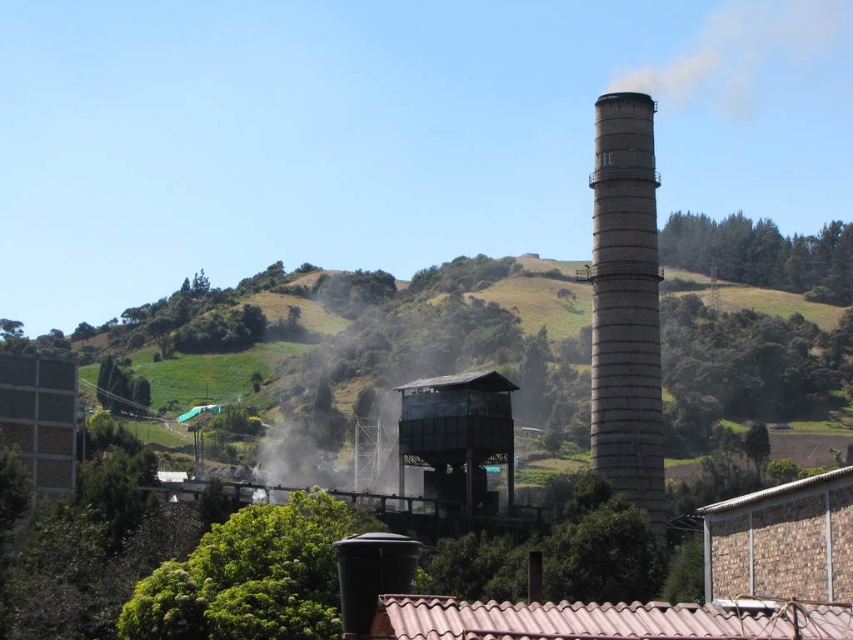
Question: In this image, where is green grassy hillside at center located relative to gray concrete chimney at center-right?

Choices:
 (A) left
 (B) right

Answer: (A)

Question: Does green grassy hillside at center appear on the right side of matte black tower at center?

Choices:
 (A) yes
 (B) no

Answer: (B)

Question: Based on their relative distances, which object is nearer to the green grassy hillside at center?

Choices:
 (A) matte black tower at center
 (B) gray concrete chimney at center-right

Answer: (A)

Question: Which object is closer to the camera taking this photo?

Choices:
 (A) gray concrete chimney at center-right
 (B) green grassy hillside at center
 (C) matte black tower at center

Answer: (A)

Question: Among these objects, which one is farthest from the camera?

Choices:
 (A) matte black tower at center
 (B) gray concrete chimney at center-right
 (C) green grassy hillside at center

Answer: (C)

Question: Does green grassy hillside at center appear on the left side of matte black tower at center?

Choices:
 (A) yes
 (B) no

Answer: (A)